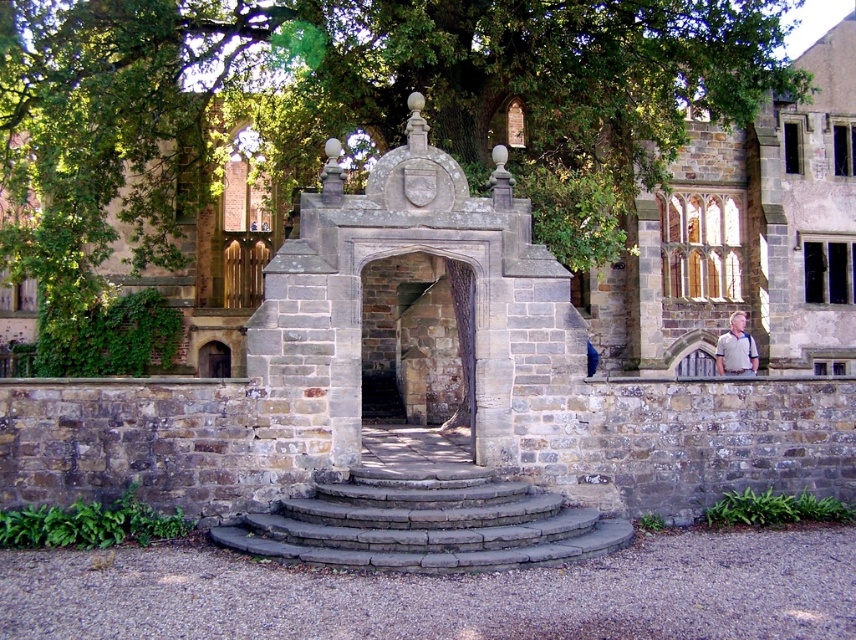
You are a photographer planning to capture the stone archway at center and the gray cotton shirt at right in a single frame. Considering their sizes, which object should you focus on to ensure both are clearly visible in the photo?

The stone archway at center is larger than the gray cotton shirt at right, so focusing on the stone archway at center would ensure both are clearly visible as it occupies more space in the frame.

You are standing at the base of the stone archway at center and want to take a photo of the green leafy tree at upper center. Which direction should you point your camera to capture the tree in the frame?

The green leafy tree at upper center is located above the stone archway at center, so you should point your camera upward to capture it in the frame.

Based on the photo, you are standing at the base of the stone archway at center and want to hand a gray cotton shirt at right to a friend who is standing on the steps leading up to the archway. Can you reach them while holding the shirt out?

The stone archway at center is located above the gray cotton shirt at right, meaning the shirt is positioned lower than the archway. Since your friend is on the steps leading up to the archway, they are likely at a higher elevation. You would need to extend the gray cotton shirt at right upward towards them to make the handoff possible.